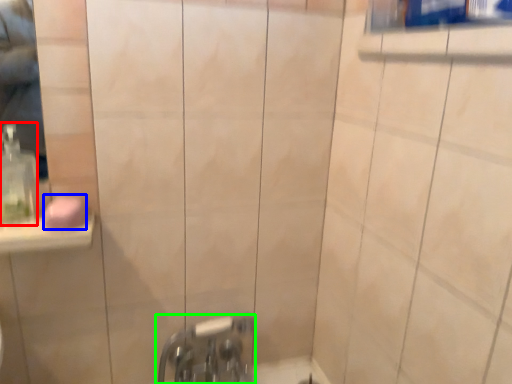
Question: Which object is the farthest from soap dispenser (highlighted by a red box)? Choose among these: soap (highlighted by a blue box) or tap (highlighted by a green box).

Choices:
 (A) soap
 (B) tap

Answer: (B)